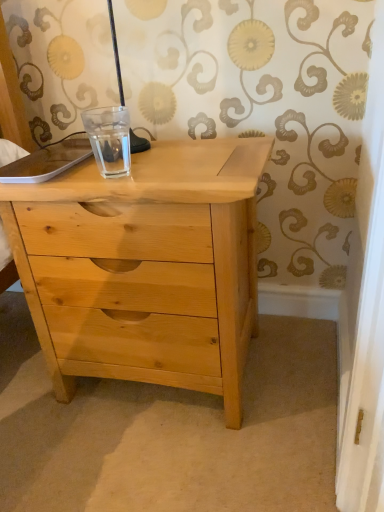
Where is `free space above natural wood chest of drawers at center (from a real-world perspective)`? free space above natural wood chest of drawers at center (from a real-world perspective) is located at coordinates (147, 162).